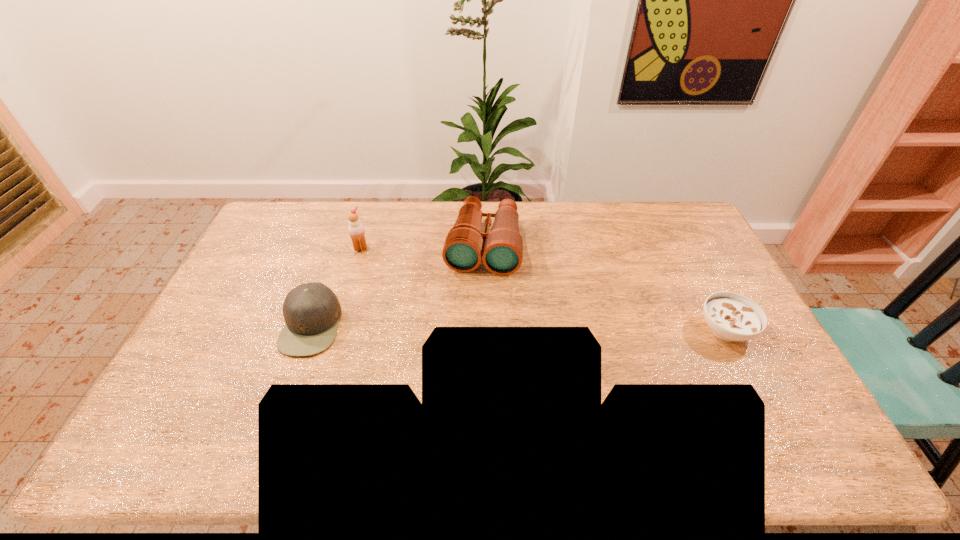
This screenshot has height=540, width=960. In order to click on vacant area that lies between the binoculars and the icecream in this screenshot , I will do pyautogui.click(x=421, y=247).

Where is `free space between the soup bowl and the icecream`? free space between the soup bowl and the icecream is located at coordinates (543, 289).

Locate an element on the screen. The image size is (960, 540). vacant area that lies between the cap and the soup bowl is located at coordinates (518, 327).

At what (x,y) coordinates should I click in order to perform the action: click on unoccupied position between the icecream and the third tallest object. Please return your answer as a coordinate pair (x, y). Looking at the image, I should click on (336, 287).

In order to click on the third closest object relative to the icecream in this screenshot , I will do coord(730,316).

Select which object is the second closest to the icecream. Please provide its 2D coordinates. Your answer should be formatted as a tuple, i.e. [(x, y)], where the tuple contains the x and y coordinates of a point satisfying the conditions above.

[(501, 250)]

I want to click on vacant area that satisfies the following two spatial constraints: 1. on the front side of the icecream; 2. on the right side of the shortest object, so click(x=336, y=329).